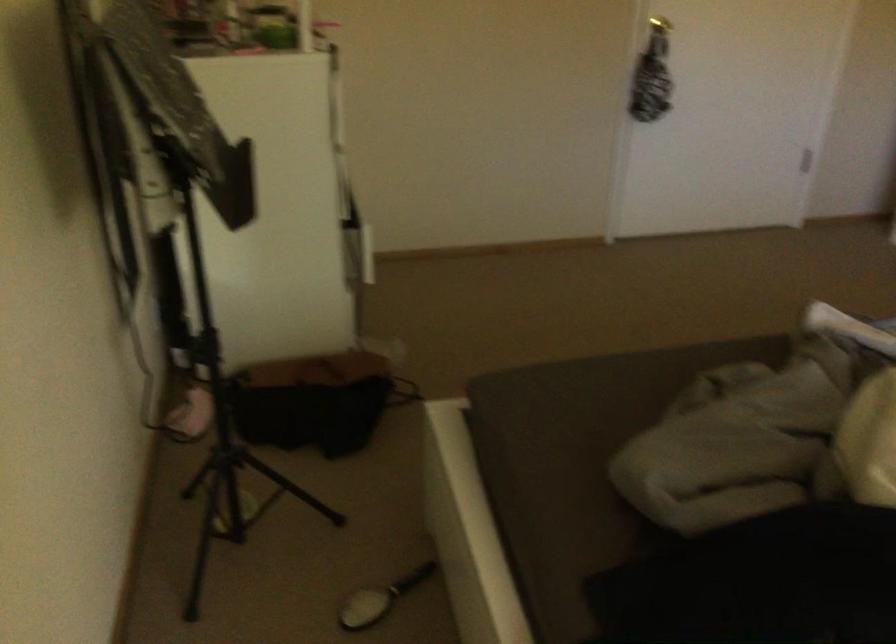
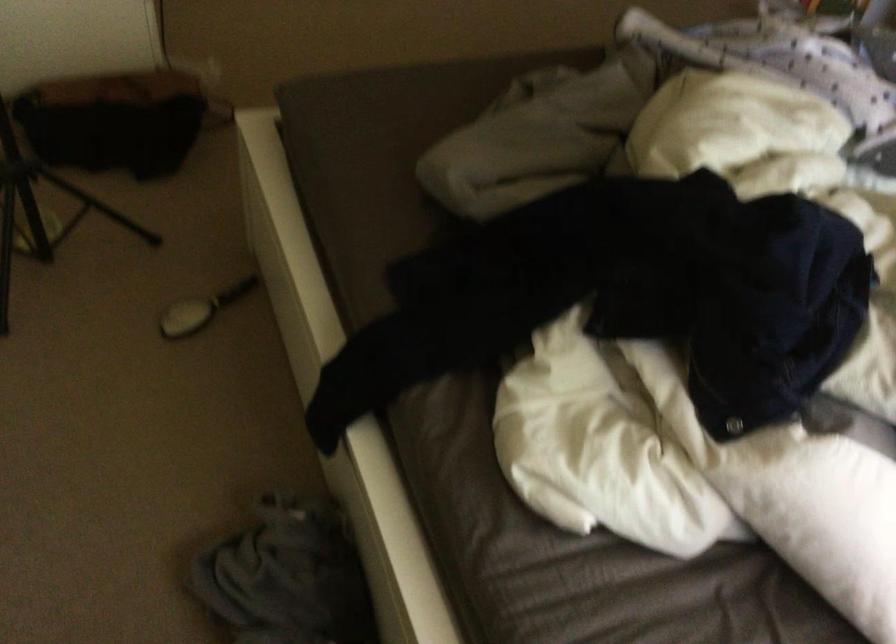
Question: The images are taken continuously from a first-person perspective. In which direction is your viewpoint rotating?

Choices:
 (A) Left
 (B) Right
 (C) Up
 (D) Down

Answer: (D)